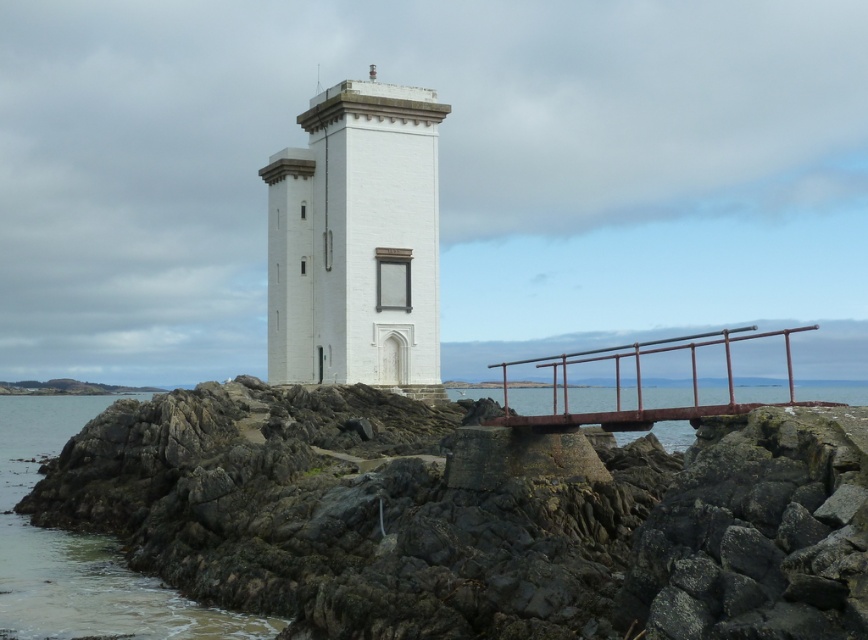
You are standing at the edge of the rocky shore and want to reach the white matte tower at center. According to the coordinates provided, what are the exact coordinates you need to navigate to in order to reach it?

The white matte tower at center is located at coordinates point (356, 241).

You are a maintenance worker needing to reach the lighthouse door. You are standing on the rough stone rocks at center and see the clear water at lower left. Which path would you choose to reach the lighthouse door safely?

You should choose the path over the rough stone rocks at center because they are larger and more stable compared to the clear water at lower left, which is smaller and less secure.

You are standing at the point marked as point (288, 464) and want to reach the lighthouse. The walkway is 50 meters long. Can you safely walk to the lighthouse using the walkway?

The distance between you and the lighthouse is 52.20 meters, but the walkway is only 50 meters long. Therefore, you cannot safely reach the lighthouse using the walkway as it is too short.